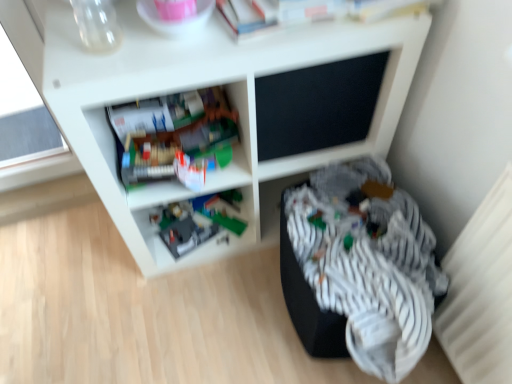
Image resolution: width=512 pixels, height=384 pixels. Find the location of `free spot in front of plastic gray toy at lower center, positioned as the first shelf in back-to-front order`. free spot in front of plastic gray toy at lower center, positioned as the first shelf in back-to-front order is located at coordinates point(185,284).